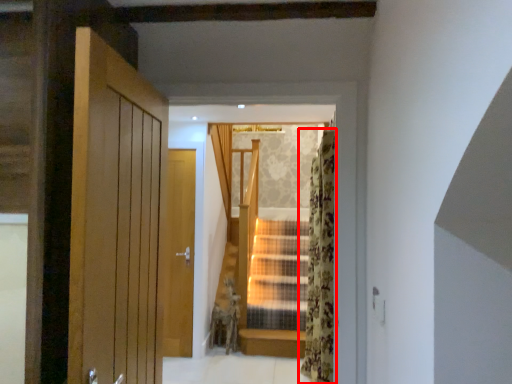
Question: In this image, where is curtain (annotated by the red box) located relative to curtain?

Choices:
 (A) right
 (B) left

Answer: (A)